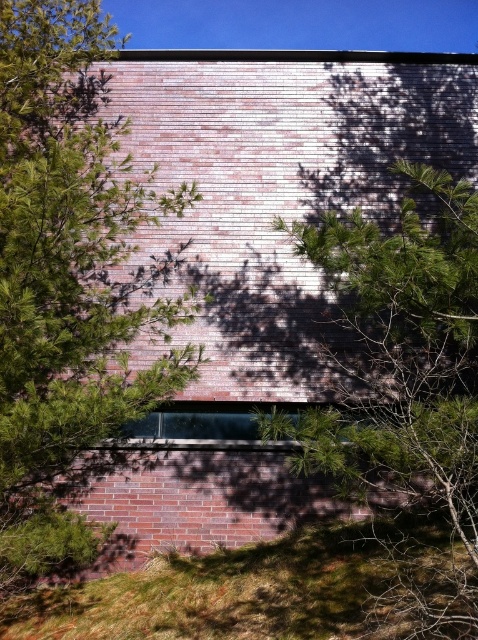
You are a gardener who needs to water both the green leafy tree at center and the green grass at lower center. Since you have a watering can with a 1.5 meter reach, can you water both plants without moving the can?

The green leafy tree at center is 1.23 meters away from the green grass at lower center. Since the watering can has a 1.5 meter reach, you can water both plants without moving the can because the distance between them is within the can reach.

You are standing in front of the building wall and want to reach both the point at coordinates point (437,301) and point (338,580). Which point should you reach first?

You should reach point (437,301) first because it is closer to you than point (338,580).

You are standing in front of a building with two green leafy trees. The trees are labeled as the green leafy tree at left and the green leafy tree at center. Which tree is wider?

The green leafy tree at center is wider than the green leafy tree at left.